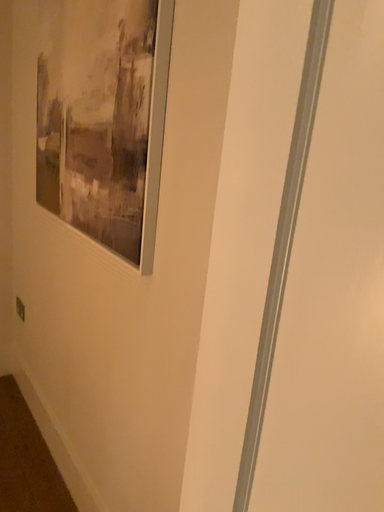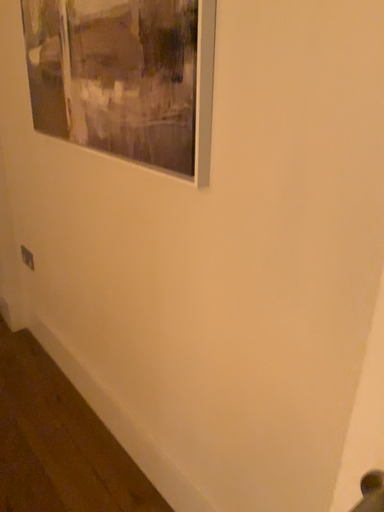
Question: Which way did the camera rotate in the video?

Choices:
 (A) rotated downward
 (B) rotated upward

Answer: (A)